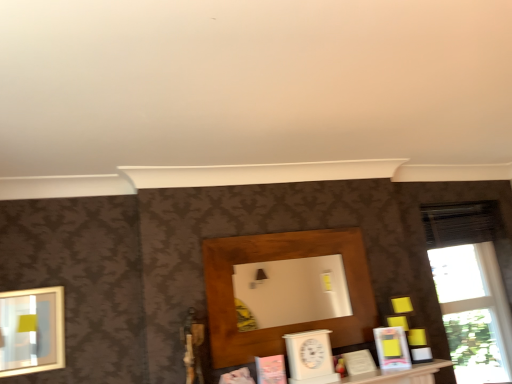
At what (x,y) coordinates should I click in order to perform the action: click on free point above wooden shelf at center (from a real-world perspective). Please return your answer as a coordinate pair (x, y). Image resolution: width=512 pixels, height=384 pixels. Looking at the image, I should click on (283, 231).